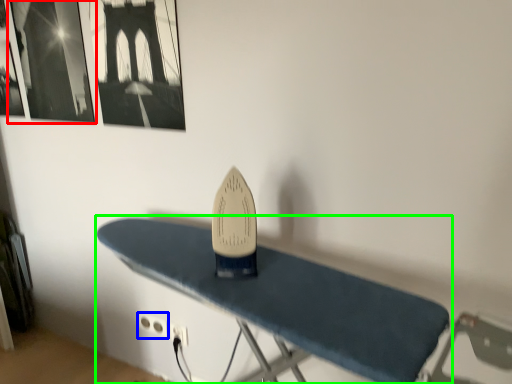
Question: Based on their relative distances, which object is nearer to picture frame (highlighted by a red box)? Choose from plug (highlighted by a blue box) and furniture (highlighted by a green box).

Choices:
 (A) plug
 (B) furniture

Answer: (B)